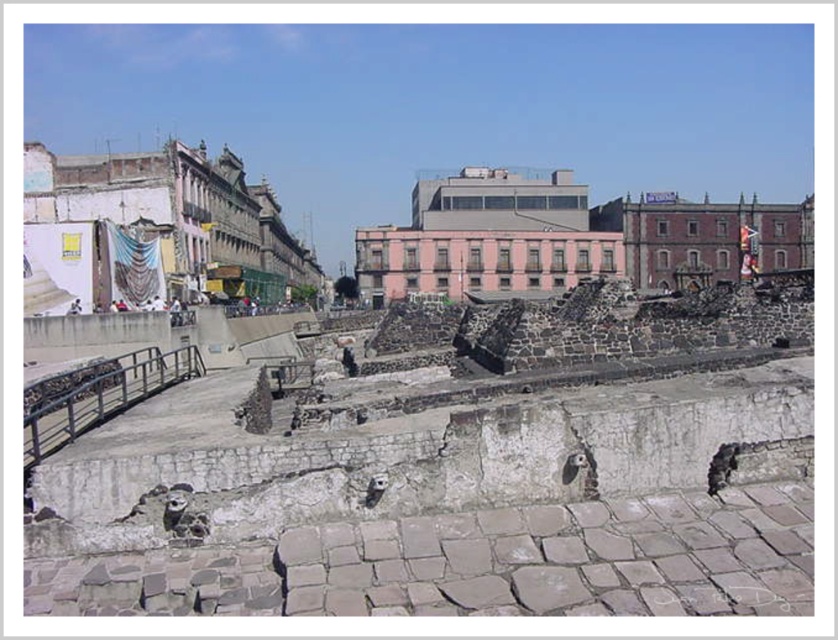
You are a tour guide explaining the site to visitors. You mention both the white stone ruins at left and the red brick ruins at center. Which of these two structures has a narrower width?

The white stone ruins at left is thinner than the red brick ruins at center, so the white stone ruins at left has a narrower width.

You are standing at the entrance of the historical site and want to take a photo of the pink concrete ruins at center. According to the coordinates provided, where should you position yourself to ensure the ruins are centered in your camera frame?

The pink concrete ruins at center are located at coordinates point (x=485, y=237), so you should position yourself directly facing that coordinate point to center them in your camera frame.

You are standing at the base of the ancient structure and want to take a photo of the red brick ruins at center and the white fabric at upper center. Which object will appear larger in the photo?

The red brick ruins at center will appear larger in the photo because it is closer to the viewer than the white fabric at upper center.